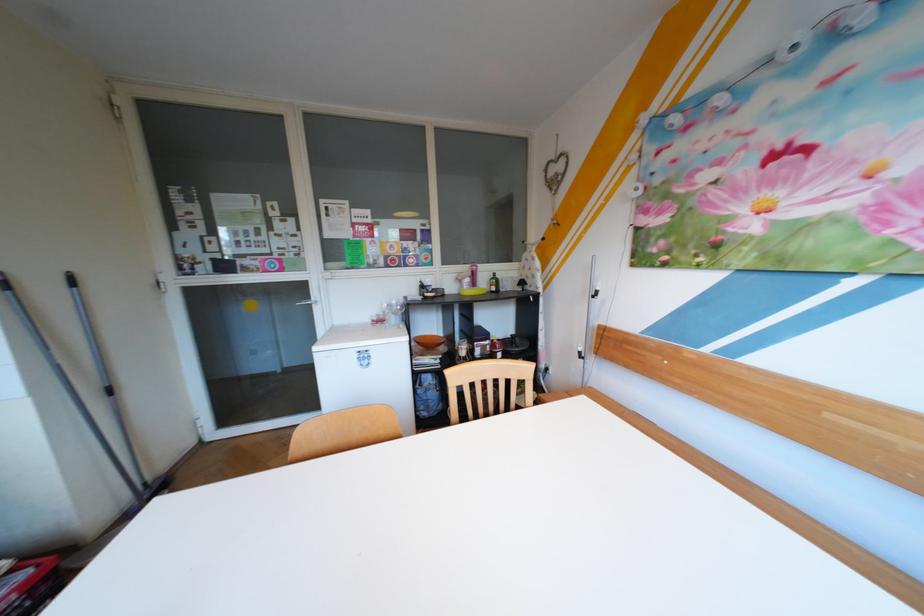
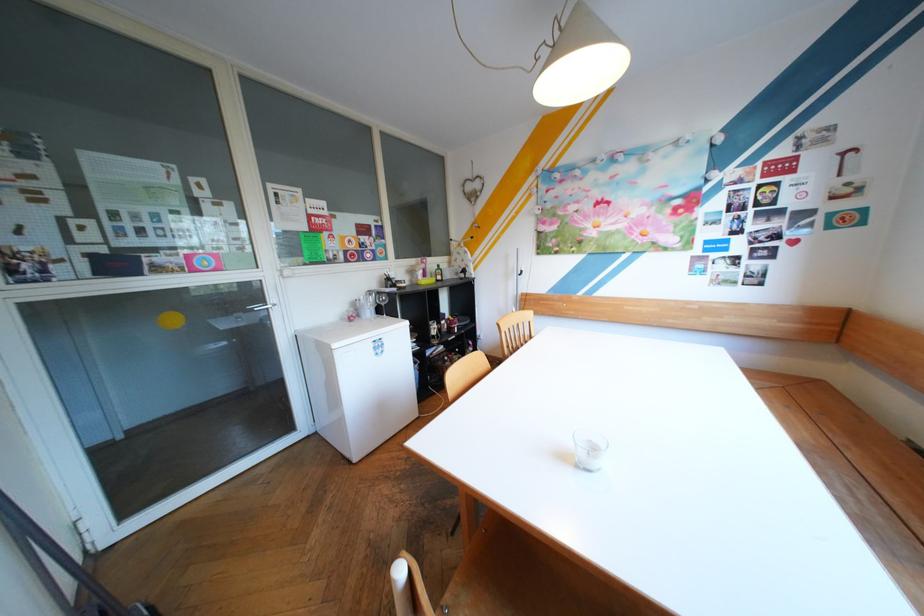
Question: I am providing you with two images of the same scene from different viewpoints. After the viewpoint changes to image2, which objects are now occluded?

Choices:
 (A) small glass cup
 (B) red food can
 (C) brown chair handle
 (D) wine glass

Answer: (B)